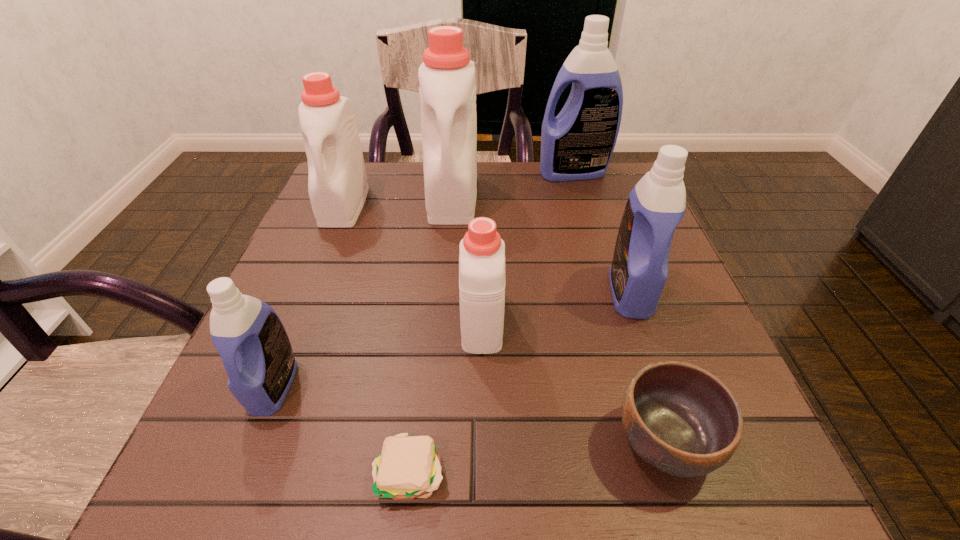
Locate an element on the screen. The width and height of the screenshot is (960, 540). vacant space at the far right corner of the desktop is located at coordinates (600, 182).

Locate an element on the screen. The image size is (960, 540). vacant region between the biggest white detergent and the smallest blue detergent is located at coordinates (363, 292).

The height and width of the screenshot is (540, 960). I want to click on unoccupied area between the farthest blue detergent and the nearest white detergent, so click(527, 247).

At what (x,y) coordinates should I click in order to perform the action: click on free space that is in between the patty and the second smallest white detergent. Please return your answer as a coordinate pair (x, y). The height and width of the screenshot is (540, 960). Looking at the image, I should click on (377, 339).

Where is `vacant point located between the seventh tallest object and the nearest blue detergent`? This screenshot has height=540, width=960. vacant point located between the seventh tallest object and the nearest blue detergent is located at coordinates (469, 414).

What are the coordinates of `vacant space that's between the second smallest blue detergent and the nearest white detergent` in the screenshot? It's located at (556, 307).

The image size is (960, 540). I want to click on unoccupied area between the second biggest blue detergent and the nearest blue detergent, so click(x=452, y=339).

I want to click on vacant area that lies between the nearest white detergent and the leftmost white detergent, so click(413, 263).

Where is `blank region between the farthest blue detergent and the biggest white detergent`? The width and height of the screenshot is (960, 540). blank region between the farthest blue detergent and the biggest white detergent is located at coordinates (513, 185).

The width and height of the screenshot is (960, 540). I want to click on vacant area that lies between the patty and the second nearest blue detergent, so click(x=520, y=382).